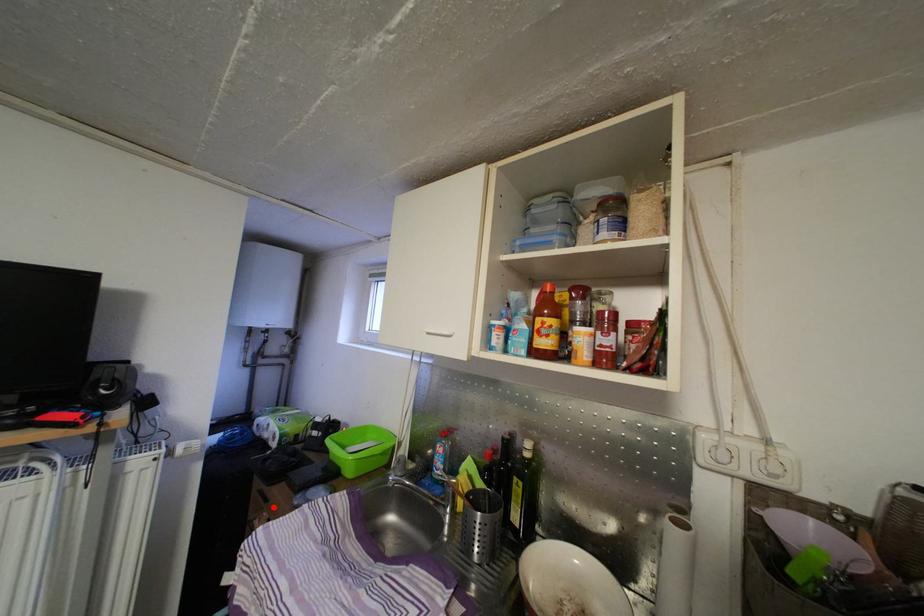
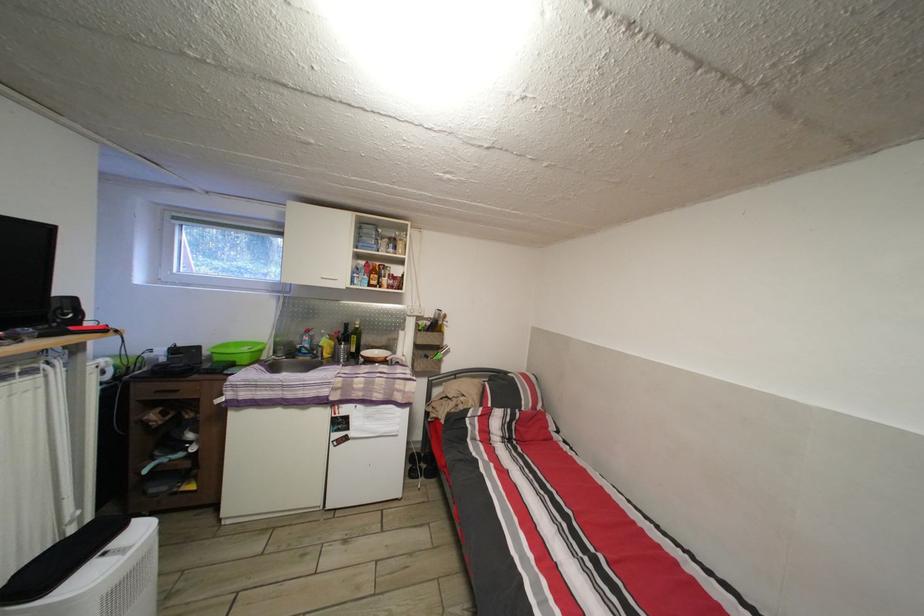
Where in the second image is the point corresponding to the highlighted location from the first image?

(184, 398)